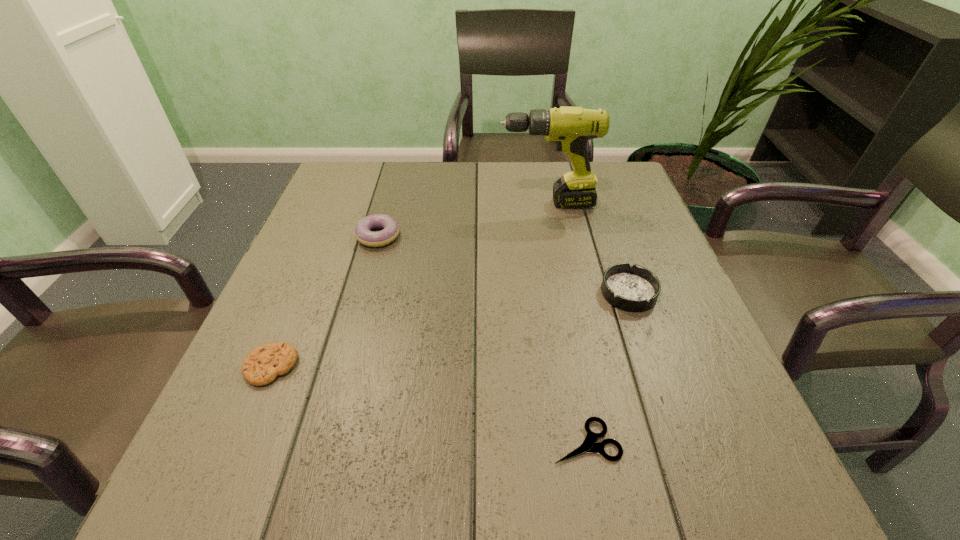
Locate an element on the screen. The image size is (960, 540). vacant position located 0.300m on the handle side of the tallest object is located at coordinates (379, 204).

Where is `vacant space located 0.160m on the handle side of the tallest object`? This screenshot has height=540, width=960. vacant space located 0.160m on the handle side of the tallest object is located at coordinates (434, 204).

Where is `vacant position located 0.300m on the handle side of the tallest object`? This screenshot has height=540, width=960. vacant position located 0.300m on the handle side of the tallest object is located at coordinates (379, 204).

I want to click on vacant space located 0.170m on the right of the doughnut, so click(473, 236).

What are the coordinates of `vacant space located on the left of the third nearest object` in the screenshot? It's located at (443, 293).

This screenshot has height=540, width=960. I want to click on free point located 0.220m on the back of the second shortest object, so click(x=313, y=265).

Where is `vacant region located 0.190m on the left of the shortest object`? This screenshot has width=960, height=540. vacant region located 0.190m on the left of the shortest object is located at coordinates (424, 441).

This screenshot has width=960, height=540. Find the location of `object at the far edge`. object at the far edge is located at coordinates (571, 128).

You are a GUI agent. You are given a task and a screenshot of the screen. Output one action in this format:
    pyautogui.click(x=<x>, y=<y>)
    Task: Click on the object that is at the near edge
    Image resolution: width=960 pixels, height=540 pixels.
    Given the screenshot: What is the action you would take?
    pyautogui.click(x=588, y=446)

Where is `doughnut present at the left edge`? Image resolution: width=960 pixels, height=540 pixels. doughnut present at the left edge is located at coordinates (x=363, y=233).